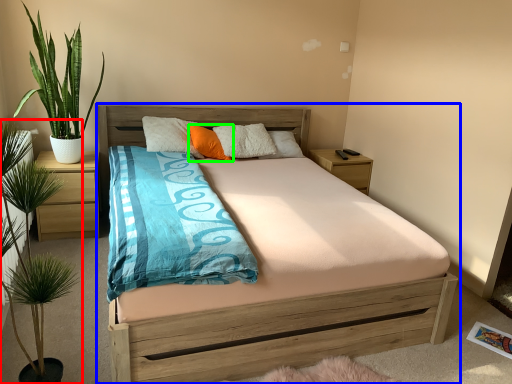
Question: Based on their relative distances, which object is farther from houseplant (highlighted by a red box)? Choose from bed (highlighted by a blue box) and pillow (highlighted by a green box).

Choices:
 (A) bed
 (B) pillow

Answer: (B)